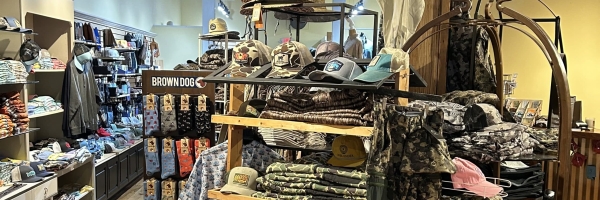
Identify the location of mannequin. (355, 45), (370, 45).